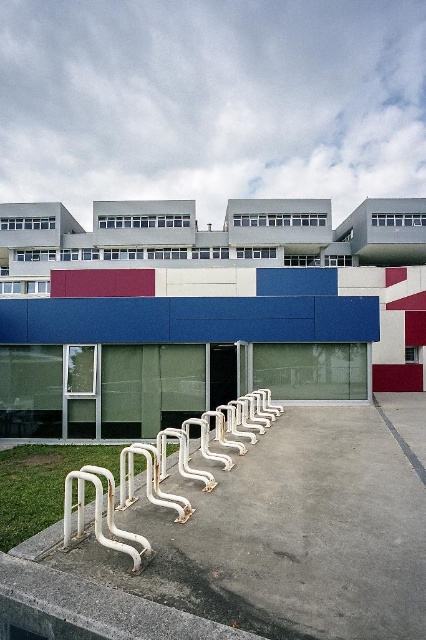
You are a delivery person trying to park your bike near the modern building. You see the white matte rail at lower center and the gray concrete line at center. Which one is more suitable for parking your bike?

The white matte rail at lower center is smaller than the gray concrete line at center, so it might not provide enough space for parking a bike. The gray concrete line at center could be a better option for parking since it is larger.

You are standing in front of the building and notice the white smooth concrete at lower left and the gray concrete line at center. Which one is located to the left of the other?

The white smooth concrete at lower left is positioned on the left side of gray concrete line at center.

You are standing in front of the modern building and want to locate two specific points marked on the concrete area. The first point is at coordinate point (206, 440) and the second is at point (420, 468). Which point is closer to you?

Point (206, 440) is closer to you because it is further to the viewer than point (420, 468).